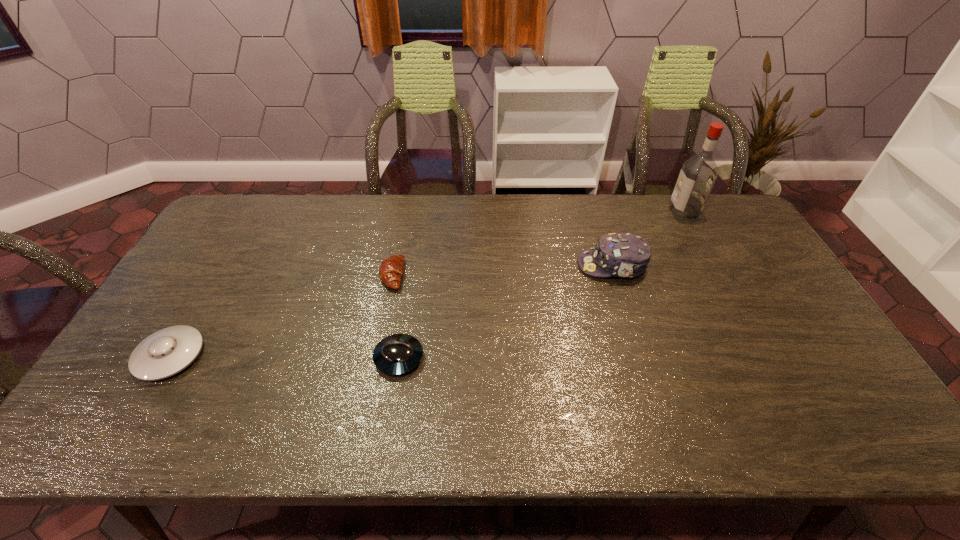
Identify the location of vacant position located 0.140m on the front-facing side of the farthest object. The width and height of the screenshot is (960, 540). (632, 211).

Locate an element on the screen. vacant space located 0.310m on the front-facing side of the headwear is located at coordinates (478, 265).

Find the location of a particular element. This screenshot has width=960, height=540. free location located 0.230m on the front-facing side of the headwear is located at coordinates (504, 265).

Locate an element on the screen. Image resolution: width=960 pixels, height=540 pixels. free space located on the front-facing side of the headwear is located at coordinates (478, 265).

This screenshot has height=540, width=960. In order to click on free space located on the back of the leftmost object in this screenshot , I will do `click(234, 247)`.

I want to click on free space located on the left of the crescent roll, so click(295, 275).

Identify the location of vacant point located 0.340m on the left of the shorter saucer. This screenshot has width=960, height=540. (242, 357).

The width and height of the screenshot is (960, 540). Identify the location of object present at the far edge. (698, 174).

Find the location of a particular element. The image size is (960, 540). object located in the left edge section of the desktop is located at coordinates (166, 352).

Identify the location of object that is at the right edge. The height and width of the screenshot is (540, 960). (698, 174).